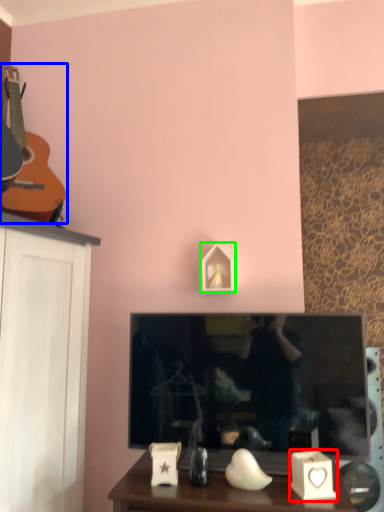
Question: Estimate the real-world distances between objects in this image. Which object is farther from candle holder (highlighted by a red box), guitar (highlighted by a blue box) or picture frame (highlighted by a green box)?

Choices:
 (A) guitar
 (B) picture frame

Answer: (A)